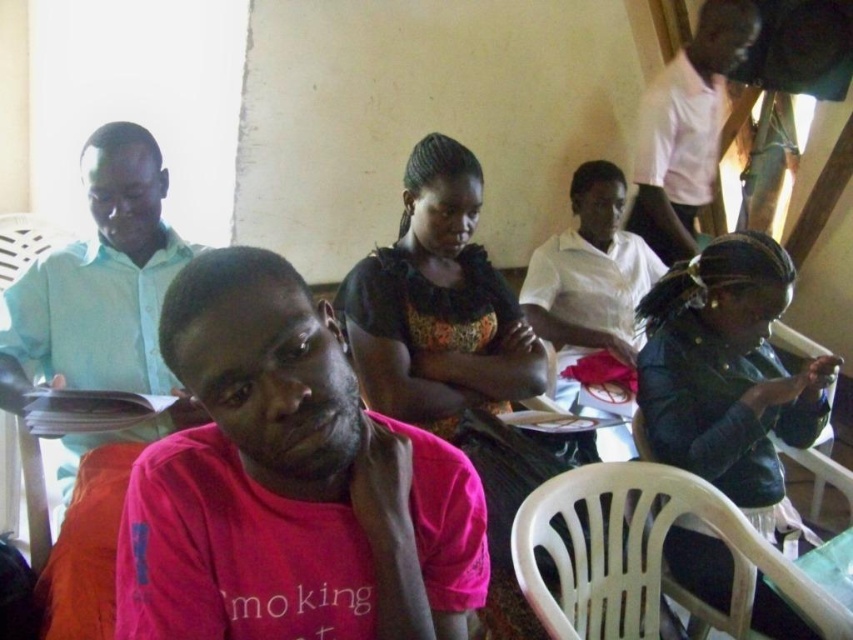
Does white shirt at upper right have a greater height compared to white plastic chair at lower right?

Indeed, white shirt at upper right has a greater height compared to white plastic chair at lower right.

Can you confirm if white shirt at upper right is positioned to the left of white plastic chair at lower right?

No, white shirt at upper right is not to the left of white plastic chair at lower right.

Who is more forward, (743, 16) or (705, 618)?

Positioned in front is point (705, 618).

Identify the location of white shirt at upper right. (686, 129).

Which of these two, black floral dress at center or green plastic table at lower right, stands taller?

Standing taller between the two is black floral dress at center.

Who is shorter, black floral dress at center or green plastic table at lower right?

green plastic table at lower right

This screenshot has height=640, width=853. What do you see at coordinates (454, 352) in the screenshot?
I see `black floral dress at center` at bounding box center [454, 352].

Where is `black floral dress at center`? The height and width of the screenshot is (640, 853). black floral dress at center is located at coordinates pos(454,352).

You are a GUI agent. You are given a task and a screenshot of the screen. Output one action in this format:
    pyautogui.click(x=<x>, y=<y>)
    Task: Click on the leather jacket at lower right
    This screenshot has height=640, width=853.
    Given the screenshot: What is the action you would take?
    point(726,369)

Is point (717, 483) behind point (572, 472)?

Yes, it is.

Is point (639, 308) positioned after point (751, 573)?

Yes, it is behind point (751, 573).

I want to click on leather jacket at lower right, so click(726, 369).